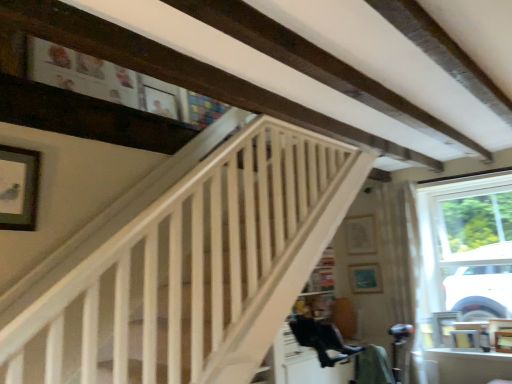
Question: From the image's perspective, is white wooden stairwell at upper center on top of sheer white curtain at right?

Choices:
 (A) no
 (B) yes

Answer: (B)

Question: Would you consider white wooden stairwell at upper center to be distant from sheer white curtain at right?

Choices:
 (A) yes
 (B) no

Answer: (A)

Question: Is white wooden stairwell at upper center taller than sheer white curtain at right?

Choices:
 (A) yes
 (B) no

Answer: (B)

Question: Does white wooden stairwell at upper center have a larger size compared to sheer white curtain at right?

Choices:
 (A) no
 (B) yes

Answer: (B)

Question: Is white wooden stairwell at upper center thinner than sheer white curtain at right?

Choices:
 (A) no
 (B) yes

Answer: (B)

Question: Can you confirm if white wooden stairwell at upper center is positioned to the left of sheer white curtain at right?

Choices:
 (A) yes
 (B) no

Answer: (A)

Question: From a real-world perspective, is wooden picture frame at lower right, which ranks as the 1th picture frame in right-to-left order, located beneath matte white picture frame at upper center, the fourth picture frame when ordered from front to back?

Choices:
 (A) no
 (B) yes

Answer: (B)

Question: Could you tell me if wooden picture frame at lower right, placed as the second picture frame when sorted from front to back, is turned towards matte white picture frame at upper center, which is the first picture frame in back-to-front order?

Choices:
 (A) yes
 (B) no

Answer: (B)

Question: Is wooden picture frame at lower right, which is the fourth picture frame in left-to-right order, wider than matte white picture frame at upper center, the fourth picture frame when ordered from front to back?

Choices:
 (A) no
 (B) yes

Answer: (B)

Question: Is wooden picture frame at lower right, placed as the second picture frame when sorted from front to back, at the left side of matte white picture frame at upper center, the fourth picture frame when ordered from front to back?

Choices:
 (A) yes
 (B) no

Answer: (B)

Question: Does wooden picture frame at lower right, which ranks as the 1th picture frame in right-to-left order, have a lesser width compared to matte white picture frame at upper center, acting as the third picture frame starting from the right?

Choices:
 (A) no
 (B) yes

Answer: (A)

Question: From a real-world perspective, is wooden picture frame at lower right, arranged as the 1th picture frame when ordered from the bottom, located higher than matte white picture frame at upper center, arranged as the 2th picture frame when viewed from the left?

Choices:
 (A) no
 (B) yes

Answer: (A)

Question: From the image's perspective, is matte white picture frame at upper center, the fourth picture frame when ordered from front to back, on top of wooden picture frame at lower right, arranged as the 1th picture frame when ordered from the bottom?

Choices:
 (A) no
 (B) yes

Answer: (B)